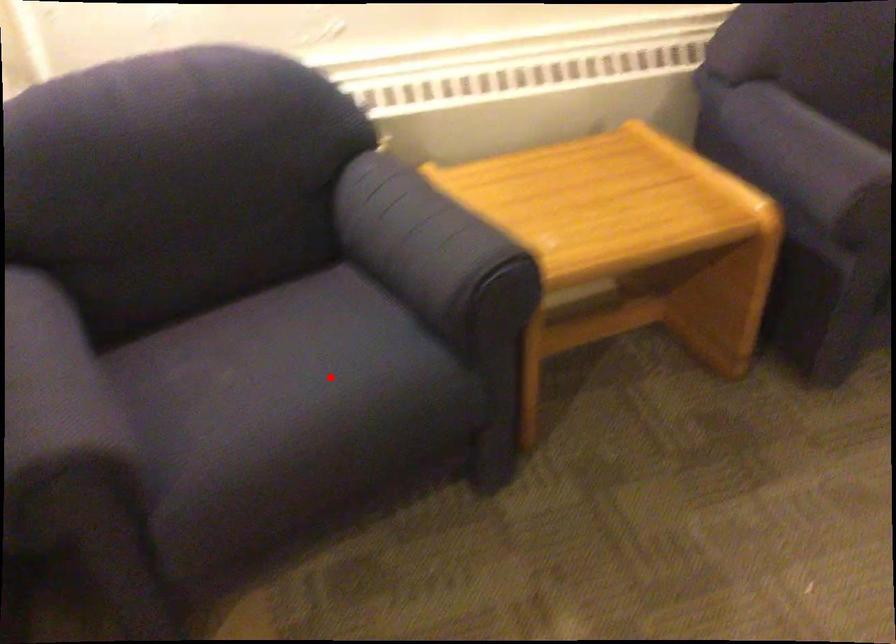
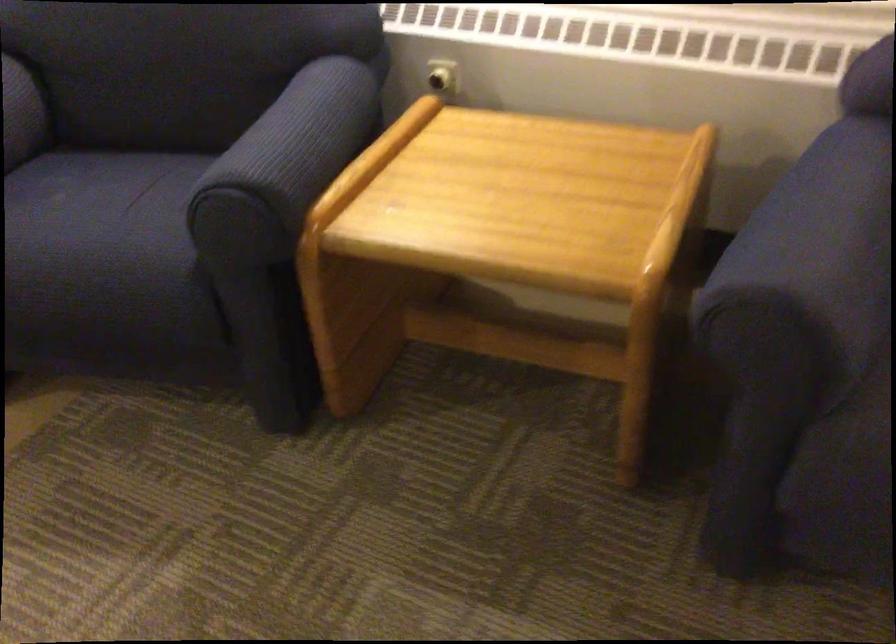
Where in the second image is the point corresponding to the highlighted location from the first image?

(99, 232)